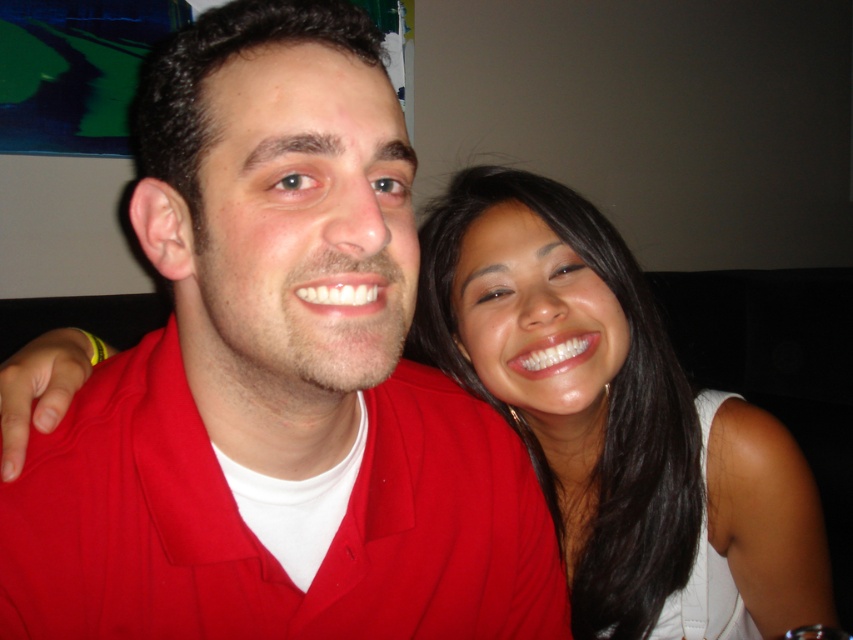
You are taking a photo of two people sitting together. You notice the matte red shirt at center and the smooth white tank top at center. Which clothing item will appear larger in the photo?

The matte red shirt at center will appear larger in the photo because it is closer to the viewer than the smooth white tank top at center.

You are a photographer standing at the origin point of the coordinate system. The matte red shirt at center is located at coordinates point 0.591, 0.325. To ensure the shirt is in the center of the photo, should you move your camera to the left or right?

The matte red shirt at center is located at coordinates point (276,378). Since the shirt is already at the center point, you don not need to move the camera.